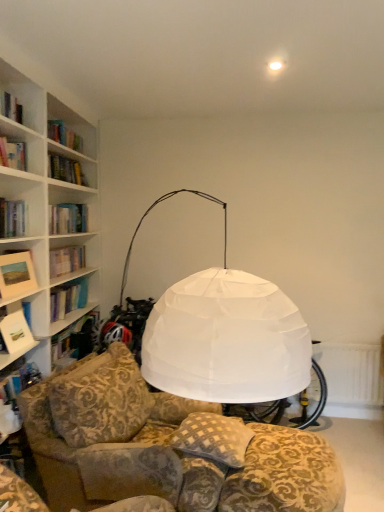
Question: Choose the correct answer: Is matte white picture frame at left inside checkered fabric pillow at center or outside it?

Choices:
 (A) inside
 (B) outside

Answer: (B)

Question: Relative to checkered fabric pillow at center, is matte white picture frame at left in front or behind?

Choices:
 (A) behind
 (B) front

Answer: (A)

Question: Which object is positioned farthest from the white paper book at left?

Choices:
 (A) white textured radiator at lower right
 (B) checkered fabric pillow at center
 (C) matte white picture frame at left

Answer: (A)

Question: Based on their relative distances, which object is farther from the checkered fabric pillow at center?

Choices:
 (A) matte white picture frame at left
 (B) white textured radiator at lower right
 (C) white paper book at left

Answer: (B)